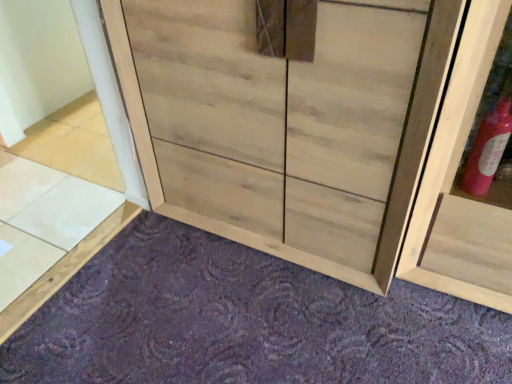
Question: From a real-world perspective, does light brown wood tile at lower left stand above natural wood cupboard at center?

Choices:
 (A) no
 (B) yes

Answer: (A)

Question: Is light brown wood tile at lower left smaller than natural wood cupboard at center?

Choices:
 (A) no
 (B) yes

Answer: (B)

Question: Does light brown wood tile at lower left have a greater width compared to natural wood cupboard at center?

Choices:
 (A) yes
 (B) no

Answer: (B)

Question: Does light brown wood tile at lower left have a lesser height compared to natural wood cupboard at center?

Choices:
 (A) yes
 (B) no

Answer: (A)

Question: From a real-world perspective, does light brown wood tile at lower left sit lower than natural wood cupboard at center?

Choices:
 (A) no
 (B) yes

Answer: (B)

Question: Is light brown wood tile at lower left positioned with its back to natural wood cupboard at center?

Choices:
 (A) no
 (B) yes

Answer: (A)

Question: Is purple carpet at lower center completely or partially outside of light brown wood tile at lower left?

Choices:
 (A) yes
 (B) no

Answer: (A)

Question: Can you confirm if purple carpet at lower center is taller than light brown wood tile at lower left?

Choices:
 (A) no
 (B) yes

Answer: (B)

Question: From the image's perspective, is purple carpet at lower center above light brown wood tile at lower left?

Choices:
 (A) no
 (B) yes

Answer: (A)

Question: Does purple carpet at lower center have a larger size compared to light brown wood tile at lower left?

Choices:
 (A) no
 (B) yes

Answer: (B)

Question: Is purple carpet at lower center not near light brown wood tile at lower left?

Choices:
 (A) yes
 (B) no

Answer: (B)

Question: Can you confirm if purple carpet at lower center is wider than light brown wood tile at lower left?

Choices:
 (A) yes
 (B) no

Answer: (A)

Question: From a real-world perspective, is natural wood cupboard at center on top of light brown wood tile at lower left?

Choices:
 (A) no
 (B) yes

Answer: (B)